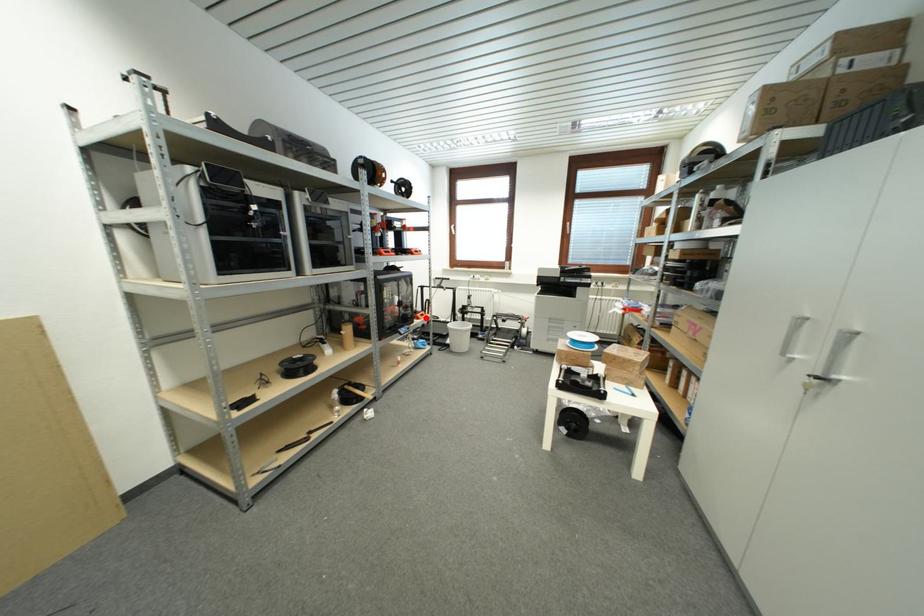
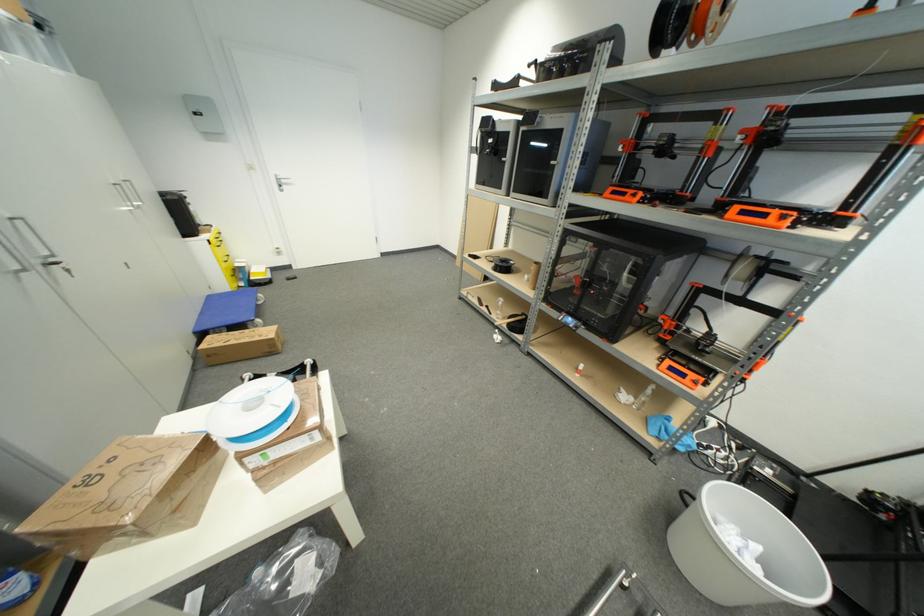
Locate, in the second image, the point that corresponds to the highlighted location in the first image.

(675, 371)